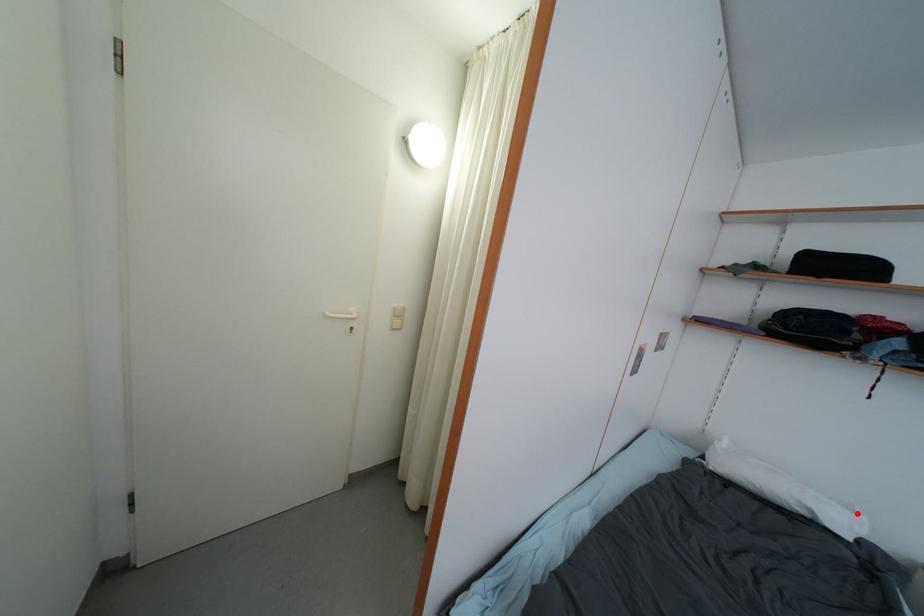
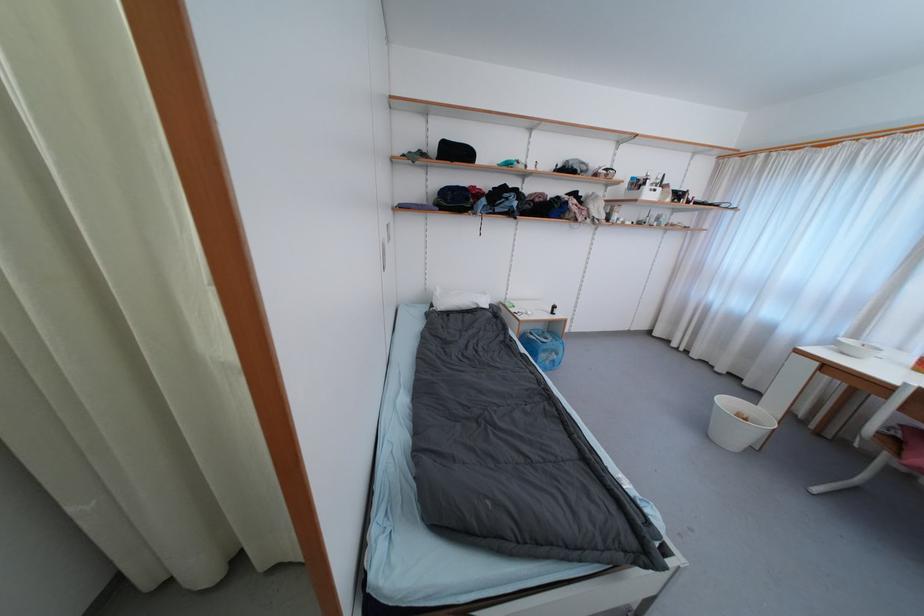
Where in the second image is the point corresponding to the highlighted location from the first image?

(489, 296)